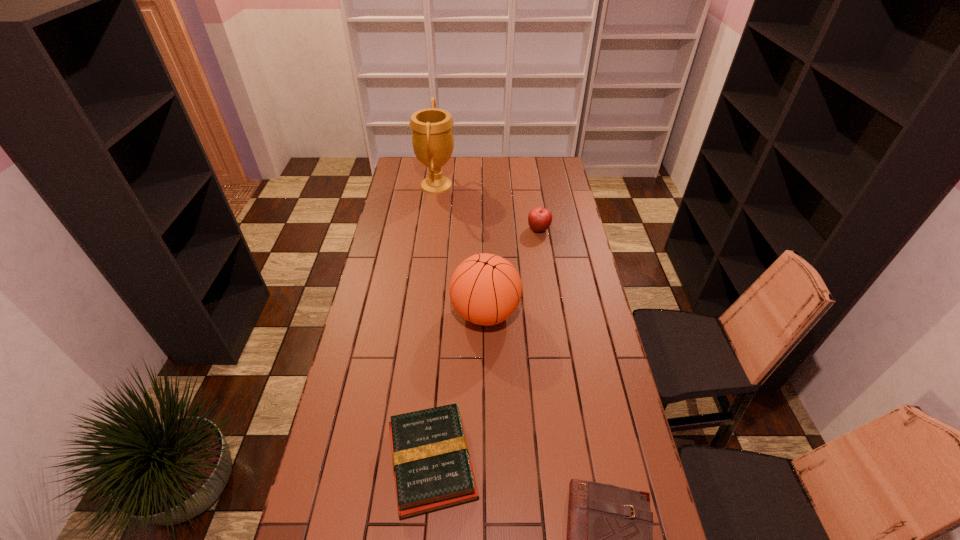
Where is `trophy`? This screenshot has width=960, height=540. trophy is located at coordinates (432, 137).

Where is `the farthest object`? This screenshot has width=960, height=540. the farthest object is located at coordinates (432, 137).

The height and width of the screenshot is (540, 960). I want to click on the third nearest object, so click(x=485, y=289).

Locate an element on the screen. This screenshot has width=960, height=540. the second tallest object is located at coordinates (485, 289).

Locate an element on the screen. apple is located at coordinates (539, 219).

I want to click on the second farthest object, so click(539, 219).

The width and height of the screenshot is (960, 540). Identify the location of the taller hardback book. (431, 461).

Locate an element on the screen. the left hardback book is located at coordinates pyautogui.click(x=431, y=461).

The height and width of the screenshot is (540, 960). In order to click on vacant region located on the engravings side of the trophy in this screenshot , I will do `click(484, 185)`.

Locate an element on the screen. The width and height of the screenshot is (960, 540). free point located on the back of the basketball is located at coordinates 485,267.